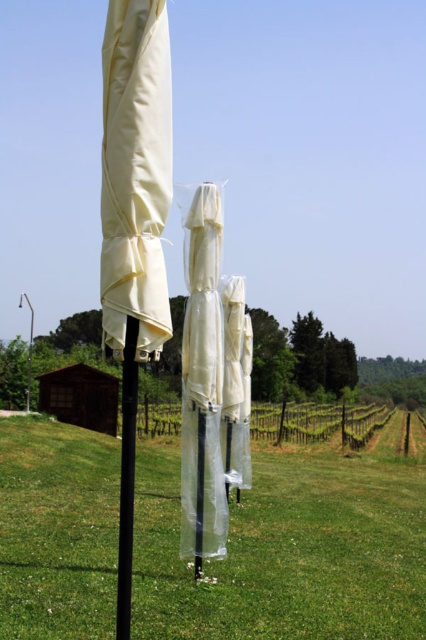
You are standing at the edge of the grassy area and see the black matte pole at center and the white plastic pole at center. Which pole would block your view of the other if you were to walk straight towards them?

The black matte pole at center is in front of the white plastic pole at center, so it would block your view of the white plastic pole at center as you walk straight towards them.

You are standing at the point marked by the coordinates (x=287, y=550) in the image. Looking around, what do you see immediately below your feet?

You are standing on the green grass at center located at point (x=287, y=550).